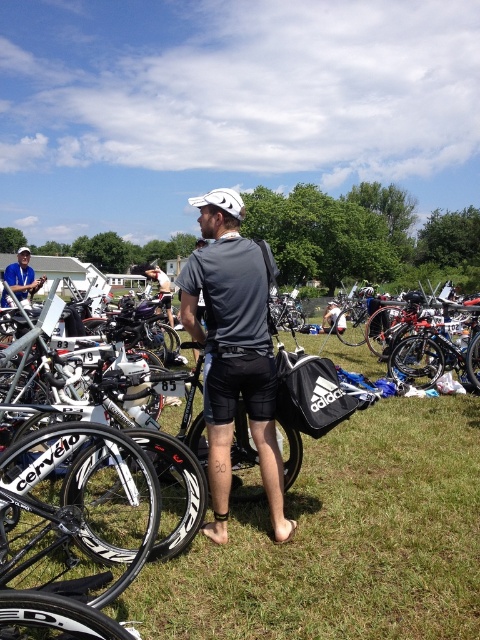
Question: Does shiny blue frame at center have a smaller size compared to brushed metal helmet at upper left?

Choices:
 (A) no
 (B) yes

Answer: (B)

Question: Which is farther from the black matte bag at center?

Choices:
 (A) gray matte shirt at center
 (B) shiny blue frame at center
 (C) matte gray shirt at center

Answer: (C)

Question: Which object is the farthest from the gray matte shirt at center?

Choices:
 (A) matte gray shirt at center
 (B) black matte bag at center
 (C) shiny blue frame at center
 (D) brushed metal helmet at upper left

Answer: (A)

Question: Which point is farther to the camera?

Choices:
 (A) shiny blue frame at center
 (B) matte gray shirt at center
 (C) gray matte shirt at center
 (D) black matte bag at center

Answer: (B)

Question: Observing the image, what is the correct spatial positioning of gray matte shirt at center in reference to matte black shorts at center?

Choices:
 (A) right
 (B) left

Answer: (B)

Question: Is brushed metal helmet at upper left wider than matte black shorts at center?

Choices:
 (A) yes
 (B) no

Answer: (A)